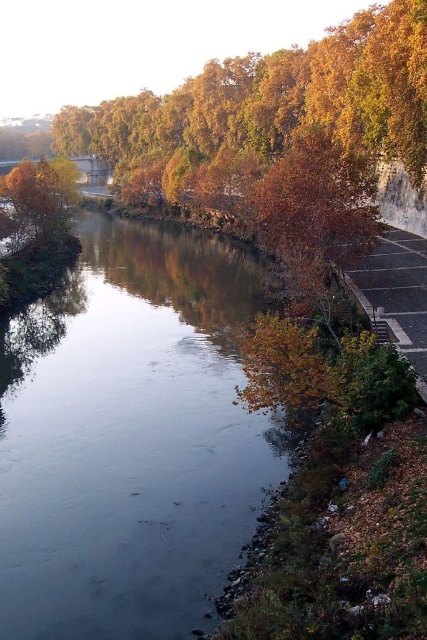
Question: Does dark reflective water at center appear on the left side of golden textured tree at lower left?

Choices:
 (A) no
 (B) yes

Answer: (A)

Question: Which point appears closest to the camera in this image?

Choices:
 (A) (35, 204)
 (B) (96, 316)

Answer: (B)

Question: Is dark reflective water at center closer to camera compared to golden textured tree at lower left?

Choices:
 (A) yes
 (B) no

Answer: (A)

Question: Does dark reflective water at center come in front of golden textured tree at lower left?

Choices:
 (A) no
 (B) yes

Answer: (B)

Question: Which point is closer to the camera?

Choices:
 (A) (131, 392)
 (B) (46, 209)

Answer: (A)